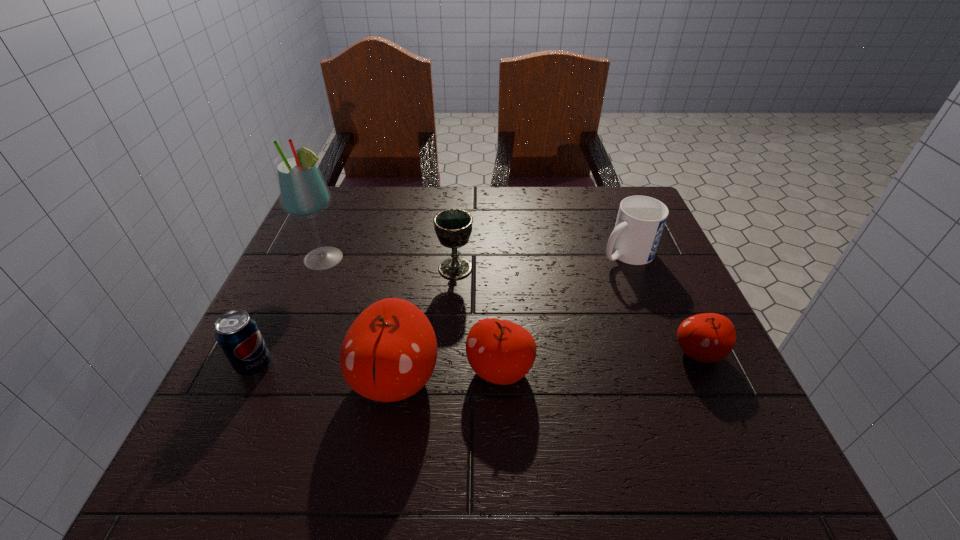
The height and width of the screenshot is (540, 960). Find the location of `mug present at the right edge`. mug present at the right edge is located at coordinates (x=640, y=221).

At what (x,y) coordinates should I click in order to perform the action: click on object present at the near left corner. Please return your answer as a coordinate pair (x, y). Looking at the image, I should click on (238, 334).

Locate an element on the screen. The image size is (960, 540). vacant space at the far edge is located at coordinates (562, 215).

In the image, there is a desktop. At what (x,y) coordinates should I click in order to perform the action: click on free space at the near edge. Please return your answer as a coordinate pair (x, y). The height and width of the screenshot is (540, 960). Looking at the image, I should click on (330, 418).

Identify the location of free spot at the left edge of the desktop. Image resolution: width=960 pixels, height=540 pixels. (294, 277).

In order to click on free spot at the right edge of the desktop in this screenshot , I will do `click(640, 276)`.

Where is `free space at the far left corner of the desktop`? This screenshot has width=960, height=540. free space at the far left corner of the desktop is located at coordinates (324, 212).

In the image, there is a desktop. At what (x,y) coordinates should I click in order to perform the action: click on blank space at the near left corner. Please return your answer as a coordinate pair (x, y). The height and width of the screenshot is (540, 960). Looking at the image, I should click on (228, 393).

Where is `vacant area between the soda can and the mug`? The image size is (960, 540). vacant area between the soda can and the mug is located at coordinates (441, 309).

The width and height of the screenshot is (960, 540). I want to click on vacant area between the chalice and the mug, so (x=540, y=261).